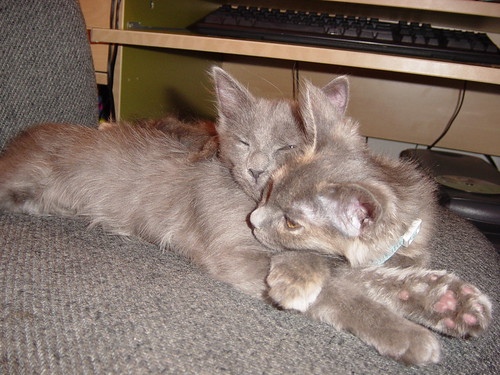
Find the location of `cushion`. cushion is located at coordinates (166, 334).